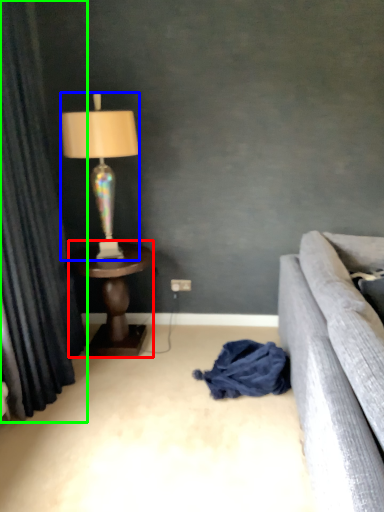
Question: Which object is the closest to the table (highlighted by a red box)? Choose among these: lamp (highlighted by a blue box) or curtain (highlighted by a green box).

Choices:
 (A) lamp
 (B) curtain

Answer: (B)